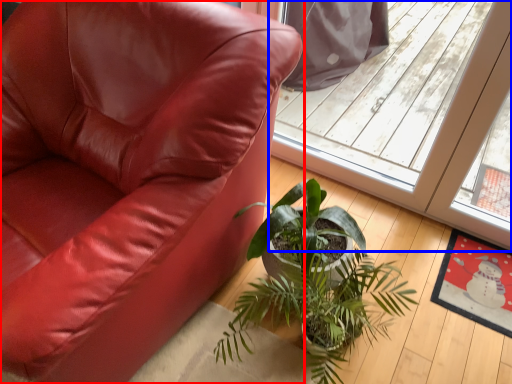
Question: Which of the following is the closest to the observer, chair (highlighted by a red box) or screen door (highlighted by a blue box)?

Choices:
 (A) chair
 (B) screen door

Answer: (A)